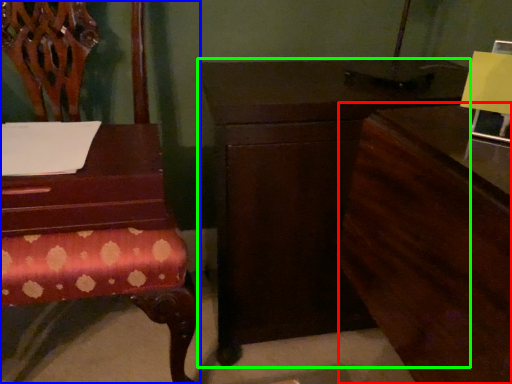
Question: Considering the real-world distances, which object is farthest from dresser (highlighted by a red box)? chair (highlighted by a blue box) or nightstand (highlighted by a green box)?

Choices:
 (A) chair
 (B) nightstand

Answer: (A)